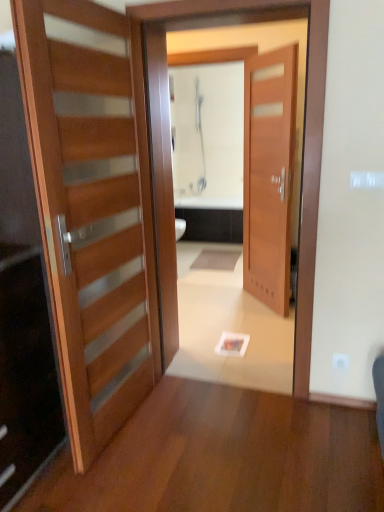
Question: Should I look upward or downward to see wooden door at center, positioned as the 1th door in right-to-left order?

Choices:
 (A) up
 (B) down

Answer: (A)

Question: From the image's perspective, is wooden door at center over wooden door at center, which is the 1th door in back-to-front order?

Choices:
 (A) yes
 (B) no

Answer: (B)

Question: Is wooden door at center located outside wooden door at center, which is the 1th door in back-to-front order?

Choices:
 (A) yes
 (B) no

Answer: (A)

Question: Can you confirm if wooden door at center is smaller than wooden door at center, the second door from the front?

Choices:
 (A) yes
 (B) no

Answer: (B)

Question: Is wooden door at center positioned with its back to wooden door at center, the second door from the front?

Choices:
 (A) yes
 (B) no

Answer: (A)

Question: Is wooden door at center, positioned as the 1th door in right-to-left order, surrounded by wooden door at center?

Choices:
 (A) yes
 (B) no

Answer: (B)

Question: Is wooden door at center further to camera compared to wooden door at center, which is the 1th door in back-to-front order?

Choices:
 (A) yes
 (B) no

Answer: (B)

Question: Is wooden door at left, which ranks as the 2th door in right-to-left order, thinner than wooden door at center, the second door from the front?

Choices:
 (A) no
 (B) yes

Answer: (A)

Question: Is wooden door at left, acting as the 1th door starting from the front, bigger than wooden door at center, acting as the 2th door starting from the left?

Choices:
 (A) no
 (B) yes

Answer: (B)

Question: Can wooden door at center, the second door from the front, be found inside wooden door at left, placed as the 1th door when sorted from left to right?

Choices:
 (A) no
 (B) yes

Answer: (A)

Question: From the image's perspective, is wooden door at left, acting as the 1th door starting from the front, located above wooden door at center, positioned as the 1th door in right-to-left order?

Choices:
 (A) no
 (B) yes

Answer: (A)

Question: Is wooden door at left, acting as the 1th door starting from the front, outside of wooden door at center, positioned as the 1th door in right-to-left order?

Choices:
 (A) no
 (B) yes

Answer: (B)

Question: Considering the relative positions of wooden door at left, acting as the 1th door starting from the front, and wooden door at center, the second door from the front, in the image provided, is wooden door at left, acting as the 1th door starting from the front, to the right of wooden door at center, the second door from the front, from the viewer's perspective?

Choices:
 (A) yes
 (B) no

Answer: (B)

Question: Is wooden door at center, which is the 1th door in back-to-front order, further to the viewer compared to wooden door at left, acting as the 1th door starting from the front?

Choices:
 (A) no
 (B) yes

Answer: (B)